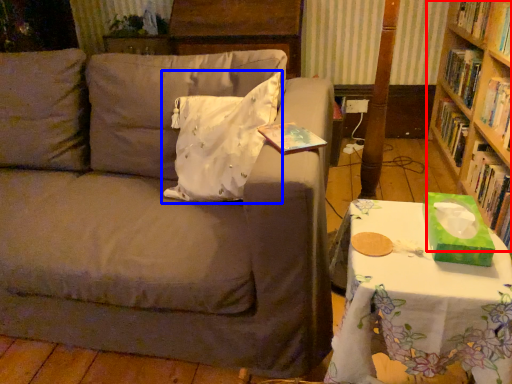
Question: Which object is further to the camera taking this photo, bookcase (highlighted by a red box) or pillow (highlighted by a blue box)?

Choices:
 (A) bookcase
 (B) pillow

Answer: (A)